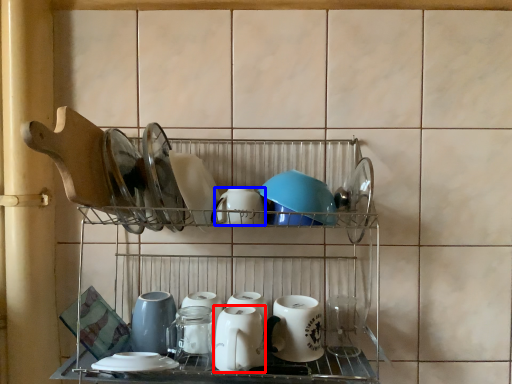
Question: Which of the following is the closest to the observer, tableware (highlighted by a red box) or tableware (highlighted by a blue box)?

Choices:
 (A) tableware
 (B) tableware

Answer: (A)